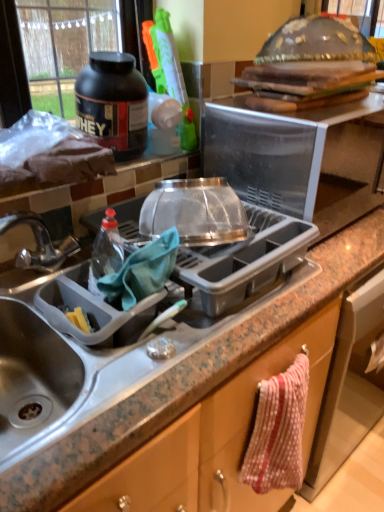
Question: Is metallic sink at left to the left of granite gray sink at lower left from the viewer's perspective?

Choices:
 (A) yes
 (B) no

Answer: (A)

Question: Is metallic sink at left in contact with granite gray sink at lower left?

Choices:
 (A) no
 (B) yes

Answer: (A)

Question: From the image's perspective, is metallic sink at left above granite gray sink at lower left?

Choices:
 (A) yes
 (B) no

Answer: (A)

Question: Is granite gray sink at lower left at the back of metallic sink at left?

Choices:
 (A) no
 (B) yes

Answer: (A)

Question: From a real-world perspective, is metallic sink at left positioned under granite gray sink at lower left based on gravity?

Choices:
 (A) yes
 (B) no

Answer: (B)

Question: From their relative heights in the image, would you say transparent plastic microwave at upper center, marked as the 2th appliance in a bottom-to-top arrangement, is taller or shorter than polka dot fabric towel at lower right?

Choices:
 (A) short
 (B) tall

Answer: (B)

Question: From a real-world perspective, is transparent plastic microwave at upper center, placed as the first appliance when sorted from top to bottom, positioned above or below polka dot fabric towel at lower right?

Choices:
 (A) below
 (B) above

Answer: (B)

Question: Considering the positions of point (327, 173) and point (279, 348), is point (327, 173) closer or farther from the camera than point (279, 348)?

Choices:
 (A) closer
 (B) farther

Answer: (B)

Question: Based on their sizes in the image, would you say transparent plastic microwave at upper center, placed as the first appliance when sorted from top to bottom, is bigger or smaller than polka dot fabric towel at lower right?

Choices:
 (A) small
 (B) big

Answer: (B)

Question: Would you say polka dot fabric towel at lower right is to the left or to the right of metallic sink at left in the picture?

Choices:
 (A) left
 (B) right

Answer: (B)

Question: Is polka dot fabric towel at lower right wider or thinner than metallic sink at left?

Choices:
 (A) wide
 (B) thin

Answer: (B)

Question: Considering the positions of point (246, 400) and point (114, 325), is point (246, 400) closer or farther from the camera than point (114, 325)?

Choices:
 (A) farther
 (B) closer

Answer: (A)

Question: Which is correct: polka dot fabric towel at lower right is inside metallic sink at left, or outside of it?

Choices:
 (A) inside
 (B) outside

Answer: (B)

Question: Considering their positions, is metallic sink at left located in front of or behind granite gray sink at lower left?

Choices:
 (A) front
 (B) behind

Answer: (B)

Question: Based on their positions, is metallic sink at left located to the left or right of granite gray sink at lower left?

Choices:
 (A) right
 (B) left

Answer: (B)